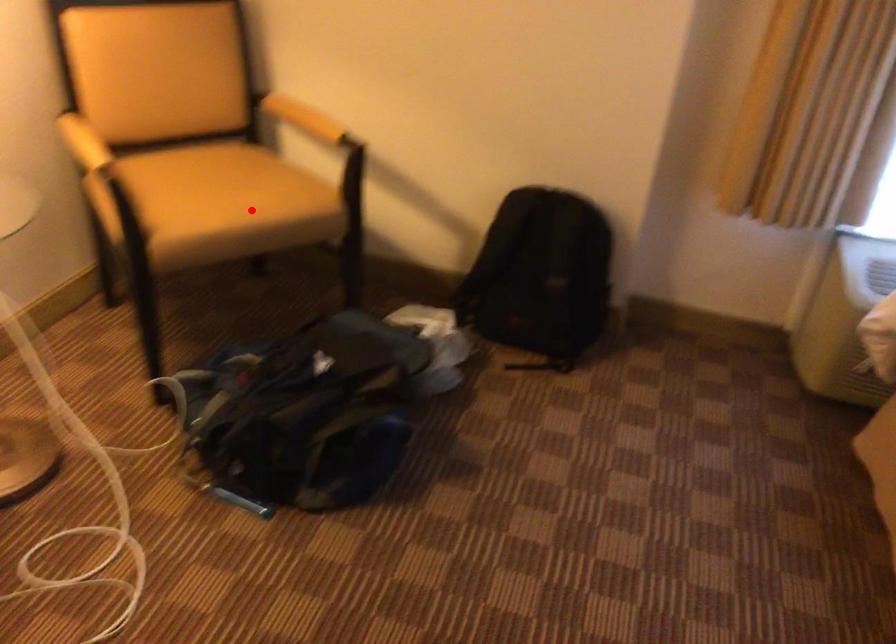
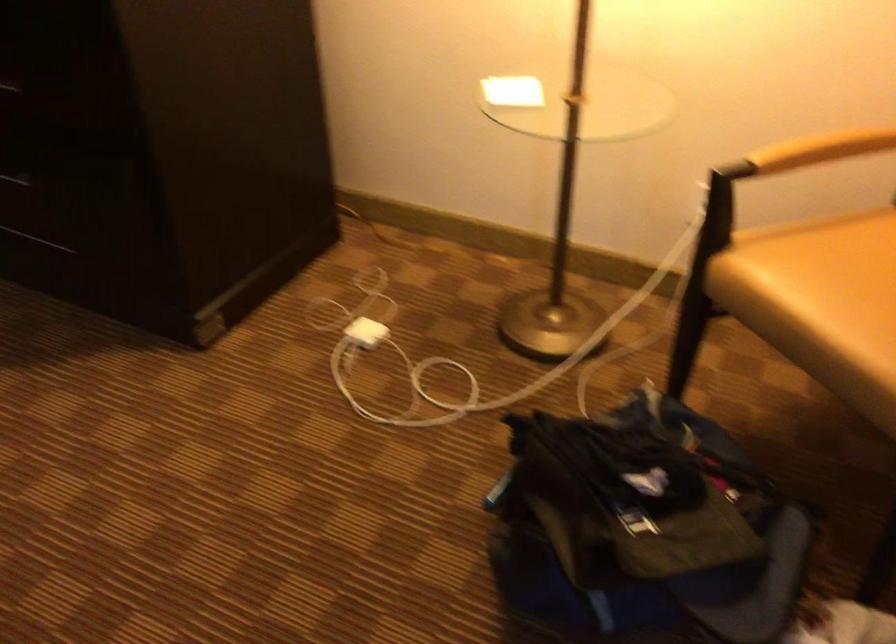
In the second image, find the point that corresponds to the highlighted location in the first image.

(821, 303)